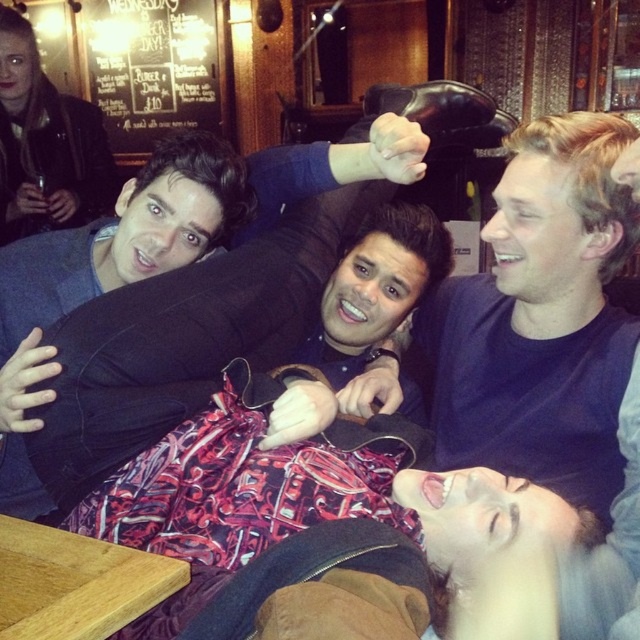
Which is behind, point (436, 308) or point (129, 129)?

Positioned behind is point (129, 129).

Is point (627, 486) behind point (220, 116)?

No, it is not.

Which is behind, point (474, 442) or point (204, 125)?

Positioned behind is point (204, 125).

This screenshot has height=640, width=640. I want to click on dark blue t-shirt at center, so click(x=550, y=349).

Which of these two, dark blue sweater at center or black chalkboard menu at upper left, stands shorter?

dark blue sweater at center is shorter.

Who is more distant from viewer, (404, 122) or (173, 58)?

Point (173, 58)

Does point (316, 192) lie behind point (140, 48)?

No.

Where is `dark blue sweater at center`? dark blue sweater at center is located at coordinates (168, 234).

Is dark blue t-shirt at center taller than dark blue sweater at center?

Correct, dark blue t-shirt at center is much taller as dark blue sweater at center.

Who is lower down, dark blue t-shirt at center or dark blue sweater at center?

dark blue t-shirt at center is lower down.

Which is in front, point (625, 124) or point (216, 186)?

Point (625, 124) is more forward.

Identify the location of dark blue t-shirt at center. (550, 349).